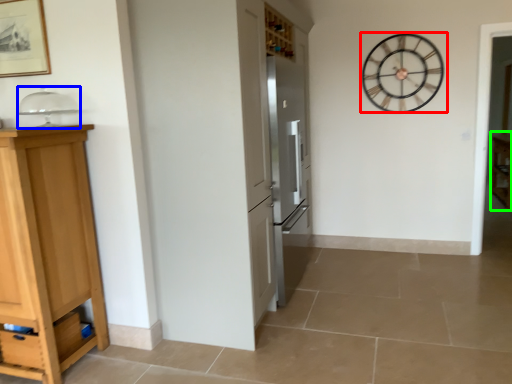
Question: Which is nearer to the wall clock (highlighted by a red box)? appliance (highlighted by a blue box) or cabinetry (highlighted by a green box).

Choices:
 (A) appliance
 (B) cabinetry

Answer: (B)